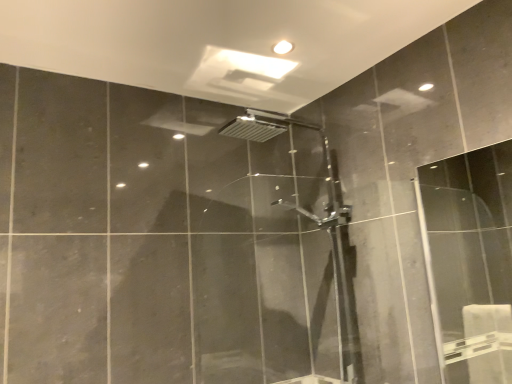
Question: Does point (349, 380) appear closer or farther from the camera than point (459, 256)?

Choices:
 (A) closer
 (B) farther

Answer: (A)

Question: Is polished chrome shower door at center inside or outside of transparent glass screen door at right?

Choices:
 (A) inside
 (B) outside

Answer: (B)

Question: Is polished chrome shower door at center wider or thinner than transparent glass screen door at right?

Choices:
 (A) wide
 (B) thin

Answer: (A)

Question: Would you say transparent glass screen door at right is inside or outside polished chrome shower door at center?

Choices:
 (A) inside
 (B) outside

Answer: (B)

Question: Considering the relative positions of transparent glass screen door at right and polished chrome shower door at center in the image provided, is transparent glass screen door at right to the left or to the right of polished chrome shower door at center?

Choices:
 (A) left
 (B) right

Answer: (B)

Question: Considering their positions, is transparent glass screen door at right located in front of or behind polished chrome shower door at center?

Choices:
 (A) behind
 (B) front

Answer: (B)

Question: From the image's perspective, is transparent glass screen door at right positioned above or below polished chrome shower door at center?

Choices:
 (A) above
 (B) below

Answer: (A)